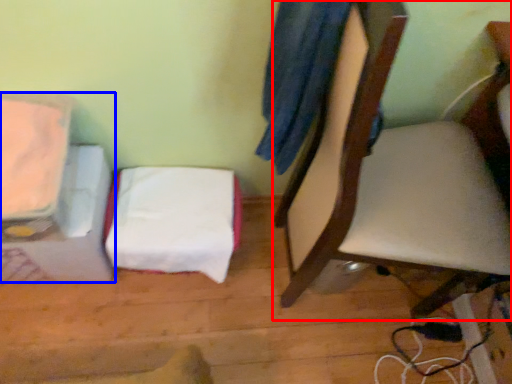
Question: Which of the following is the closest to the observer, chair (highlighted by a red box) or furniture (highlighted by a blue box)?

Choices:
 (A) chair
 (B) furniture

Answer: (A)